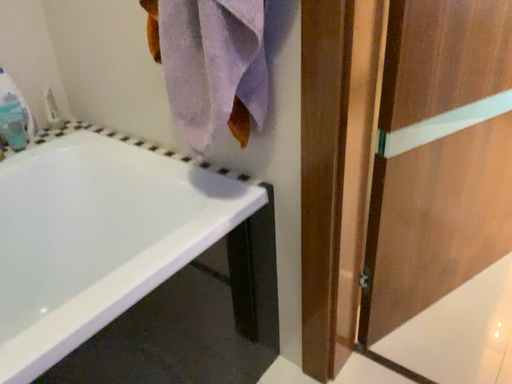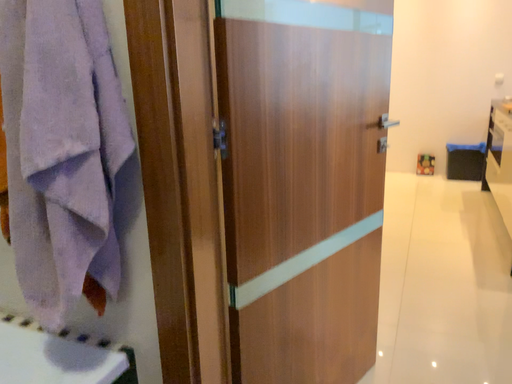
Question: How did the camera likely rotate when shooting the video?

Choices:
 (A) rotated right
 (B) rotated left

Answer: (A)